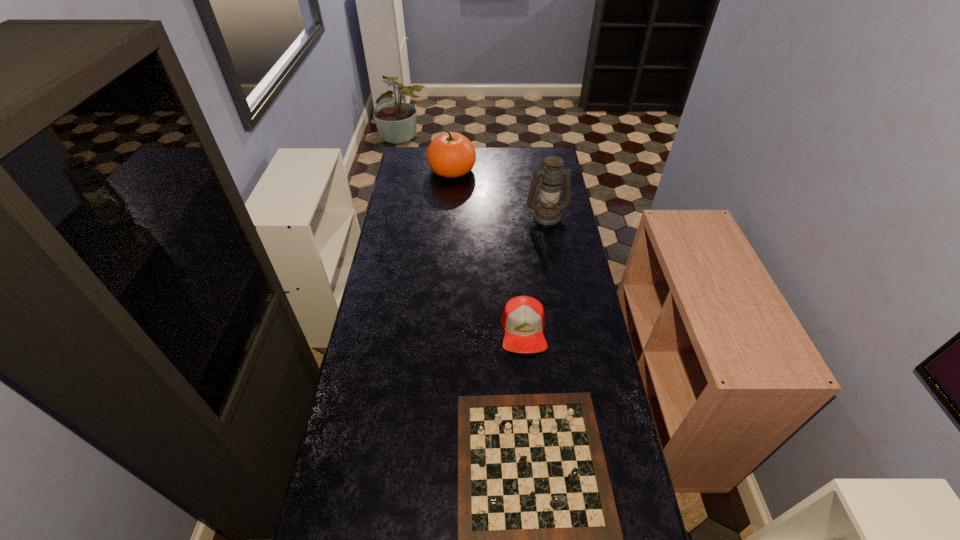
Locate an element on the screen. The height and width of the screenshot is (540, 960). free area in between the second tallest object and the baseball cap is located at coordinates (488, 250).

In order to click on blank region between the pumpkin and the tallest object in this screenshot , I will do `click(499, 193)`.

At what (x,y) coordinates should I click in order to perform the action: click on the third closest object to the third farthest object. Please return your answer as a coordinate pair (x, y). The height and width of the screenshot is (540, 960). Looking at the image, I should click on (450, 155).

Identify the location of object that ranks as the closest to the second tallest object. (547, 212).

The width and height of the screenshot is (960, 540). What are the coordinates of `free region that satisfies the following two spatial constraints: 1. on the front side of the tallest object; 2. on the right side of the pumpkin` in the screenshot? It's located at (448, 215).

Where is `free space that satisfies the following two spatial constraints: 1. on the front side of the tallest object; 2. on the left side of the pumpkin`? This screenshot has height=540, width=960. free space that satisfies the following two spatial constraints: 1. on the front side of the tallest object; 2. on the left side of the pumpkin is located at coordinates (448, 215).